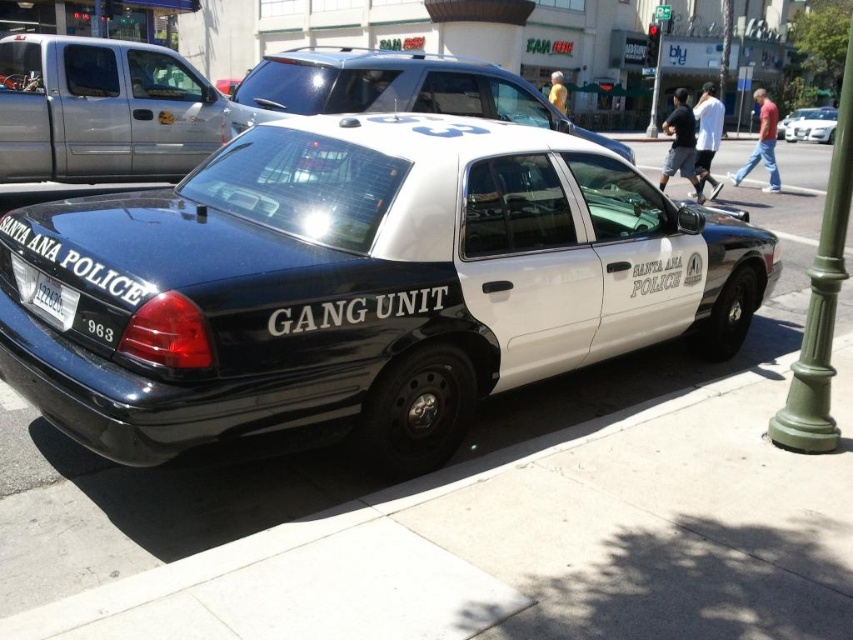
You are a delivery person who needs to park a 6.5 feet tall delivery van between the white glossy sedan at center and the metallic silver sedan at center. Based on the scene, can the delivery van fit vertically between them?

The white glossy sedan at center is not as tall as metallic silver sedan at center, so the delivery van that is 6.5 feet tall may not fit vertically between them if the taller metallic silver sedan at center is less than 6.5 feet in height. However, without knowing the exact height of the metallic silver sedan at center, it is uncertain.

You are a pedestrian standing on the sidewalk next to the green lamppost. You see the matte black police car at center and the white glossy sedan at center. Which vehicle takes up more space in the scene?

The matte black police car at center has a larger size compared to the white glossy sedan at center, so it takes up more space in the scene.

You are a pedestrian standing on the sidewalk next to the green lamppost. You see the matte black police car at center and the white glossy sedan at center. Which vehicle is closer to you?

The matte black police car at center is closer to you because it is in front of the white glossy sedan at center.